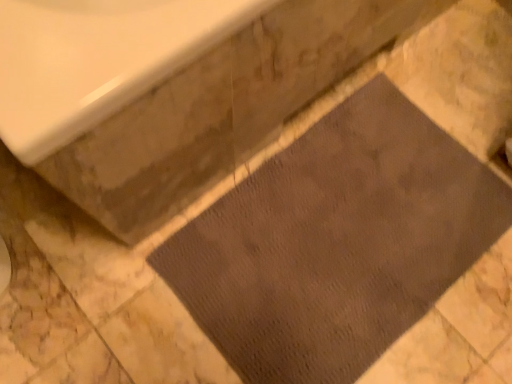
Question: Considering the positions of brown textured mat at lower right and brown textured mat at center in the image, is brown textured mat at lower right wider or thinner than brown textured mat at center?

Choices:
 (A) thin
 (B) wide

Answer: (B)

Question: Is brown textured mat at lower right in front of or behind brown textured mat at center in the image?

Choices:
 (A) behind
 (B) front

Answer: (B)

Question: In terms of height, does brown textured mat at lower right look taller or shorter compared to brown textured mat at center?

Choices:
 (A) short
 (B) tall

Answer: (B)

Question: Is point (425, 145) closer or farther from the camera than point (239, 162)?

Choices:
 (A) farther
 (B) closer

Answer: (A)

Question: Looking at their shapes, would you say brown textured mat at center is wider or thinner than brown textured mat at lower right?

Choices:
 (A) wide
 (B) thin

Answer: (B)

Question: From the image's perspective, is brown textured mat at center above or below brown textured mat at lower right?

Choices:
 (A) above
 (B) below

Answer: (B)

Question: Is brown textured mat at center to the left or to the right of brown textured mat at lower right in the image?

Choices:
 (A) left
 (B) right

Answer: (B)